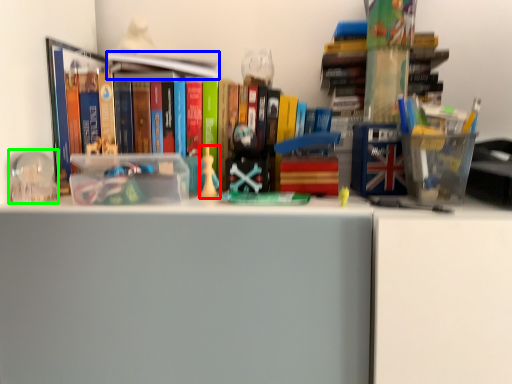
Question: Considering the real-world distances, which object is closest to toy (highlighted by a red box)? book (highlighted by a blue box) or toy (highlighted by a green box).

Choices:
 (A) book
 (B) toy

Answer: (A)